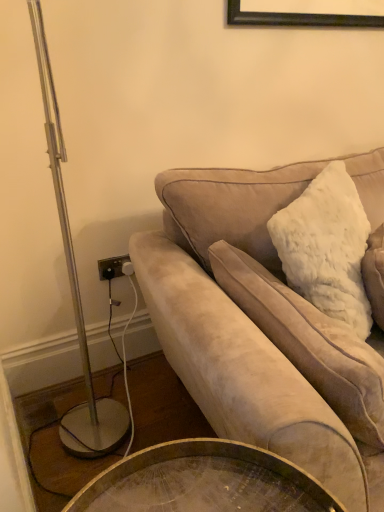
Question: From a real-world perspective, does white fluffy pillow at upper right sit lower than suede couch at right?

Choices:
 (A) no
 (B) yes

Answer: (A)

Question: Considering the relative positions of white fluffy pillow at upper right and suede couch at right in the image provided, is white fluffy pillow at upper right in front of suede couch at right?

Choices:
 (A) no
 (B) yes

Answer: (A)

Question: Does white fluffy pillow at upper right have a smaller size compared to suede couch at right?

Choices:
 (A) yes
 (B) no

Answer: (A)

Question: Is suede couch at right inside white fluffy pillow at upper right?

Choices:
 (A) no
 (B) yes

Answer: (A)

Question: Is white fluffy pillow at upper right not near suede couch at right?

Choices:
 (A) no
 (B) yes

Answer: (A)

Question: Is white fluffy pillow at upper right oriented towards suede couch at right?

Choices:
 (A) no
 (B) yes

Answer: (B)

Question: From a real-world perspective, is suede couch at right physically above white fluffy pillow at upper right?

Choices:
 (A) yes
 (B) no

Answer: (B)

Question: Can you confirm if suede couch at right is positioned to the right of white fluffy pillow at upper right?

Choices:
 (A) no
 (B) yes

Answer: (B)

Question: Is suede couch at right not within white fluffy pillow at upper right?

Choices:
 (A) yes
 (B) no

Answer: (A)

Question: Considering the relative sizes of suede couch at right and white fluffy pillow at upper right in the image provided, is suede couch at right taller than white fluffy pillow at upper right?

Choices:
 (A) no
 (B) yes

Answer: (B)

Question: Does suede couch at right turn towards white fluffy pillow at upper right?

Choices:
 (A) yes
 (B) no

Answer: (A)

Question: Is suede couch at right at the left side of white fluffy pillow at upper right?

Choices:
 (A) no
 (B) yes

Answer: (A)

Question: Which is correct: white fluffy pillow at upper right is inside suede couch at right, or outside of it?

Choices:
 (A) outside
 (B) inside

Answer: (B)